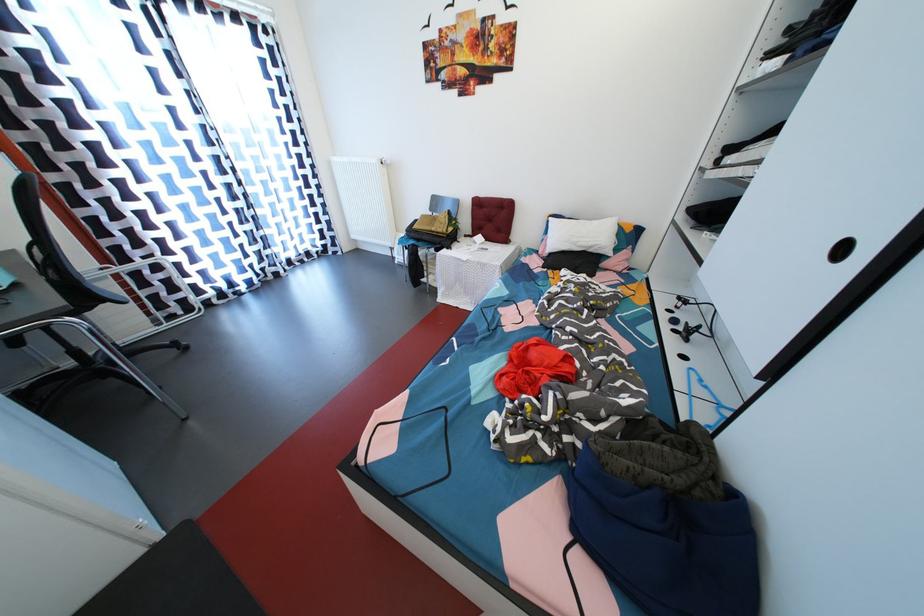
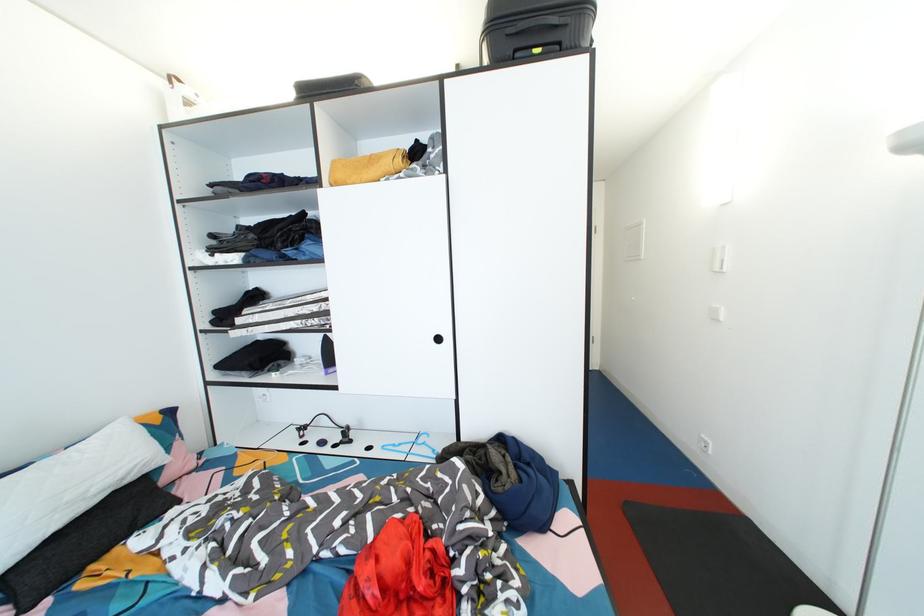
The point at (711, 392) is marked in the first image. Where is the corresponding point in the second image?

(407, 450)